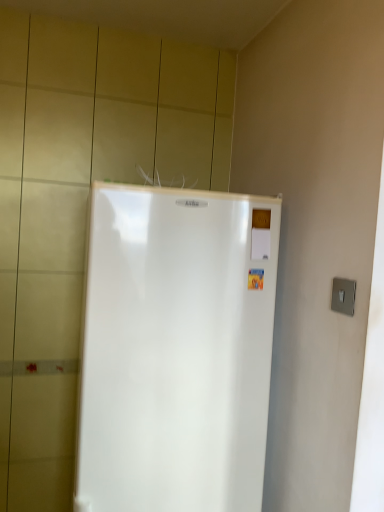
Question: Considering the positions of white glossy refrigerator at center and satin silver switch at right in the image, is white glossy refrigerator at center wider or thinner than satin silver switch at right?

Choices:
 (A) thin
 (B) wide

Answer: (B)

Question: Is white glossy refrigerator at center inside the boundaries of satin silver switch at right, or outside?

Choices:
 (A) outside
 (B) inside

Answer: (A)

Question: Considering the positions of point (163, 389) and point (336, 276), is point (163, 389) closer or farther from the camera than point (336, 276)?

Choices:
 (A) farther
 (B) closer

Answer: (A)

Question: Is satin silver switch at right taller or shorter than white glossy refrigerator at center?

Choices:
 (A) short
 (B) tall

Answer: (A)

Question: Considering their positions, is satin silver switch at right located in front of or behind white glossy refrigerator at center?

Choices:
 (A) behind
 (B) front

Answer: (B)

Question: From a real-world perspective, relative to white glossy refrigerator at center, is satin silver switch at right vertically above or below?

Choices:
 (A) below
 (B) above

Answer: (B)

Question: Looking at their shapes, would you say satin silver switch at right is wider or thinner than white glossy refrigerator at center?

Choices:
 (A) thin
 (B) wide

Answer: (A)